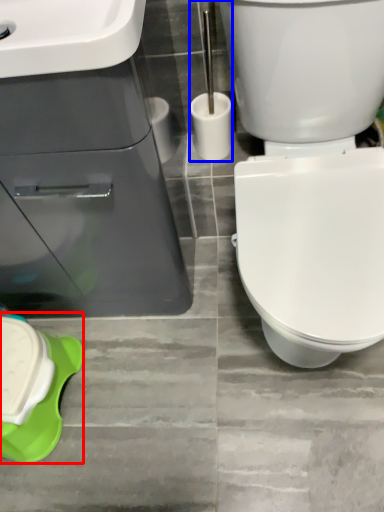
Question: Which point is further to the camera, porcelain (highlighted by a red box) or brush (highlighted by a blue box)?

Choices:
 (A) porcelain
 (B) brush

Answer: (A)